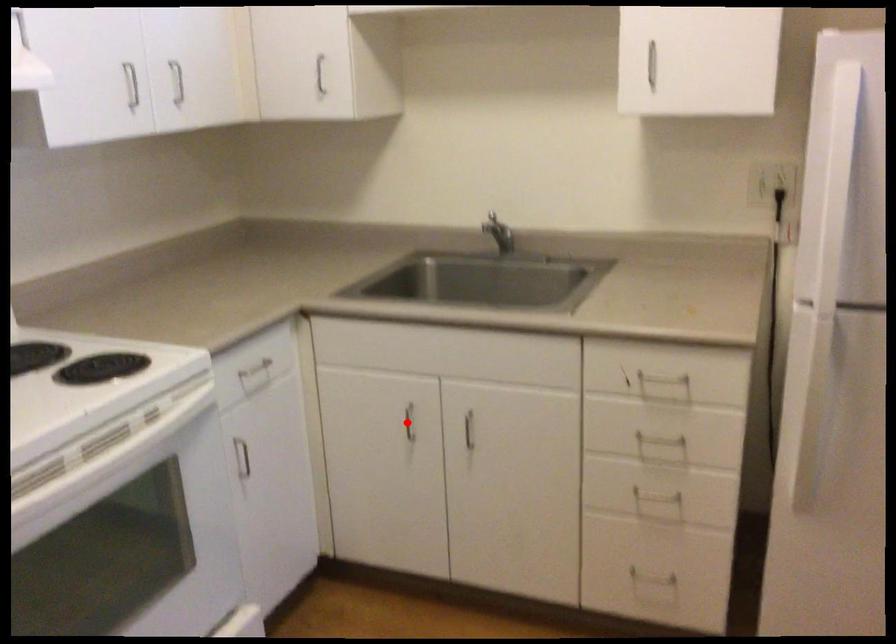
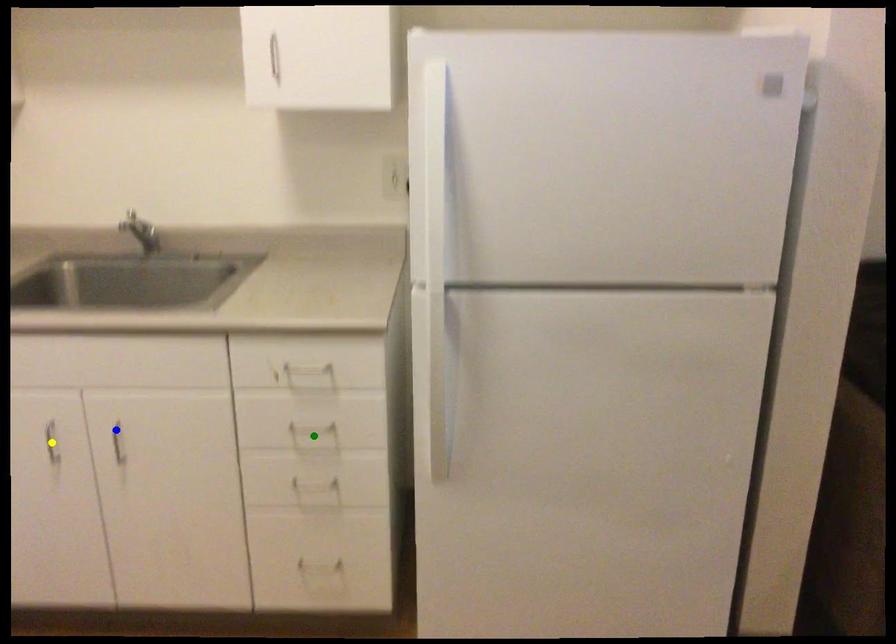
Question: I am providing you with two images of the same scene from different viewpoints. A red point is marked on the first image. You are given multiple points on the second image. Which mark in image 2 goes with the point in image 1?

Choices:
 (A) green point
 (B) blue point
 (C) yellow point

Answer: (C)